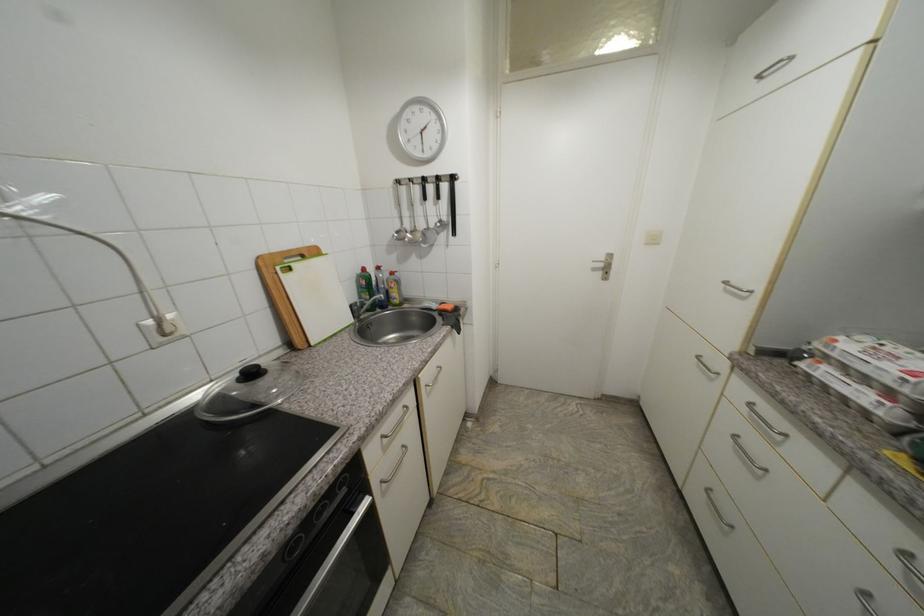
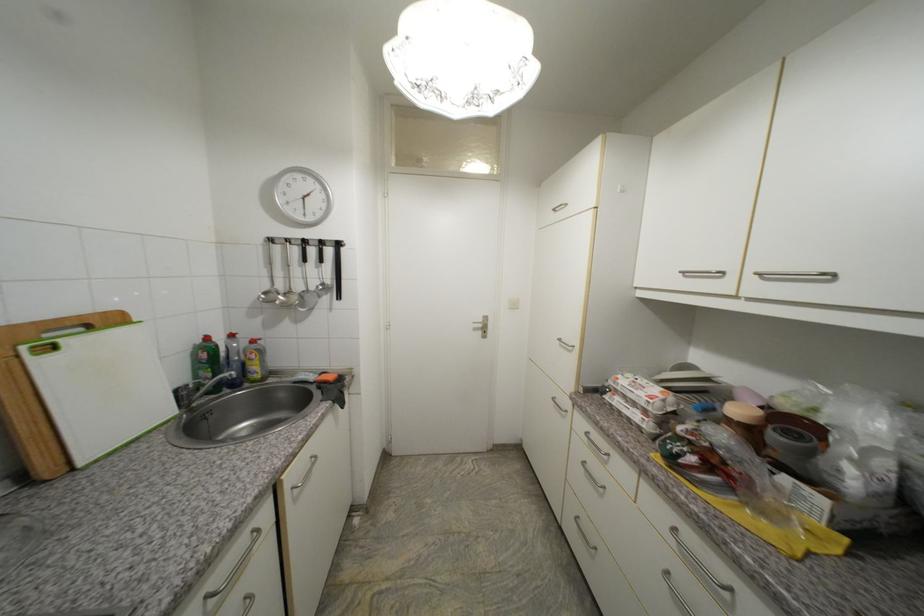
In the second image, find the point that corresponds to pixel 277 256 in the first image.

(19, 328)